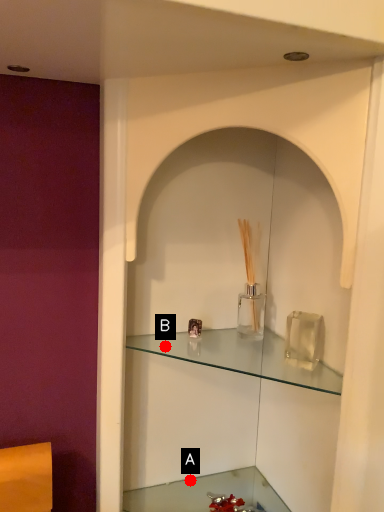
Question: Two points are circled on the image, labeled by A and B beside each circle. Among these points, which one is nearest to the camera?

Choices:
 (A) A is closer
 (B) B is closer

Answer: (B)